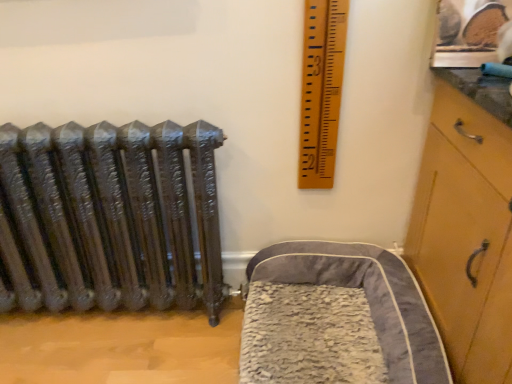
In order to face wooden ruler at upper right, should I rotate leftwards or rightwards?

Rotate right and turn 9.147 degrees.

This screenshot has width=512, height=384. Describe the element at coordinates (321, 90) in the screenshot. I see `wooden ruler at upper right` at that location.

What is the approximate width of wooden ruler at upper right?

wooden ruler at upper right is 5.53 inches in width.

The image size is (512, 384). Identify the location of wooden ruler at upper right. (321, 90).

Measure the distance between wooden ruler at upper right and camera.

They are 1.12 meters apart.

Describe the element at coordinates (367, 299) in the screenshot. I see `gray plush pet bed at lower right` at that location.

At what (x,y) coordinates should I click in order to perform the action: click on gray plush pet bed at lower right. Please return your answer as a coordinate pair (x, y). Looking at the image, I should click on (367, 299).

Locate an element on the screen. This screenshot has height=384, width=512. wooden ruler at upper right is located at coordinates (321, 90).

Based on the photo, considering the relative positions of wooden ruler at upper right and gray plush pet bed at lower right in the image provided, is wooden ruler at upper right to the right of gray plush pet bed at lower right from the viewer's perspective?

No.

Is wooden ruler at upper right positioned in front of gray plush pet bed at lower right?

No, the depth of wooden ruler at upper right is greater than that of gray plush pet bed at lower right.

Considering the positions of points (312, 147) and (371, 282), is point (312, 147) closer to camera compared to point (371, 282)?

Yes.

From the image's perspective, between wooden ruler at upper right and gray plush pet bed at lower right, which one is located above?

From the image's view, wooden ruler at upper right is above.

From a real-world perspective, is wooden ruler at upper right beneath gray plush pet bed at lower right?

No.

Which object is wider, wooden ruler at upper right or gray plush pet bed at lower right?

gray plush pet bed at lower right.

Who is taller, wooden ruler at upper right or gray plush pet bed at lower right?

Standing taller between the two is wooden ruler at upper right.

Who is bigger, wooden ruler at upper right or gray plush pet bed at lower right?

gray plush pet bed at lower right.

Is wooden ruler at upper right not within gray plush pet bed at lower right?

Absolutely, wooden ruler at upper right is external to gray plush pet bed at lower right.

Would you say wooden ruler at upper right is a long distance from gray plush pet bed at lower right?

They are positioned close to each other.

Is wooden ruler at upper right facing towards gray plush pet bed at lower right?

No, wooden ruler at upper right is not facing towards gray plush pet bed at lower right.

How many degrees apart are the facing directions of wooden ruler at upper right and gray plush pet bed at lower right?

wooden ruler at upper right and gray plush pet bed at lower right are facing 90.2 degrees away from each other.

Where is `ruler behind the gray plush pet bed at lower right`? ruler behind the gray plush pet bed at lower right is located at coordinates (321, 90).

Is gray plush pet bed at lower right to the right of wooden ruler at upper right from the viewer's perspective?

Correct, you'll find gray plush pet bed at lower right to the right of wooden ruler at upper right.

In the scene shown: Between gray plush pet bed at lower right and wooden ruler at upper right, which one is positioned in front?

gray plush pet bed at lower right is in front.

Does point (412, 333) come farther from viewer compared to point (318, 126)?

No, it is not.

From the image's perspective, relative to wooden ruler at upper right, is gray plush pet bed at lower right above or below?

gray plush pet bed at lower right is situated lower than wooden ruler at upper right in the image.

From a real-world perspective, is gray plush pet bed at lower right physically located above or below wooden ruler at upper right?

In terms of real-world spatial position, gray plush pet bed at lower right is below wooden ruler at upper right.

Considering the sizes of objects gray plush pet bed at lower right and wooden ruler at upper right in the image provided, who is wider, gray plush pet bed at lower right or wooden ruler at upper right?

gray plush pet bed at lower right.

Considering the sizes of gray plush pet bed at lower right and wooden ruler at upper right in the image, is gray plush pet bed at lower right taller or shorter than wooden ruler at upper right?

Considering their sizes, gray plush pet bed at lower right has less height than wooden ruler at upper right.

Is gray plush pet bed at lower right bigger than wooden ruler at upper right?

Indeed, gray plush pet bed at lower right has a larger size compared to wooden ruler at upper right.

Would you say gray plush pet bed at lower right is outside wooden ruler at upper right?

Yes.

Is there a large distance between gray plush pet bed at lower right and wooden ruler at upper right?

They are positioned close to each other.

Is gray plush pet bed at lower right facing towards wooden ruler at upper right?

No, gray plush pet bed at lower right is not aimed at wooden ruler at upper right.

What's the angular difference between gray plush pet bed at lower right and wooden ruler at upper right's facing directions?

The facing directions of gray plush pet bed at lower right and wooden ruler at upper right are 90.2 degrees apart.

At what (x,y) coordinates should I click in order to perform the action: click on furniture in front of the wooden ruler at upper right. Please return your answer as a coordinate pair (x, y). The image size is (512, 384). Looking at the image, I should click on (367, 299).

Locate an element on the screen. The height and width of the screenshot is (384, 512). furniture below the wooden ruler at upper right (from the image's perspective) is located at coordinates (367, 299).

What are the coordinates of `furniture on the right of wooden ruler at upper right` in the screenshot? It's located at (367, 299).